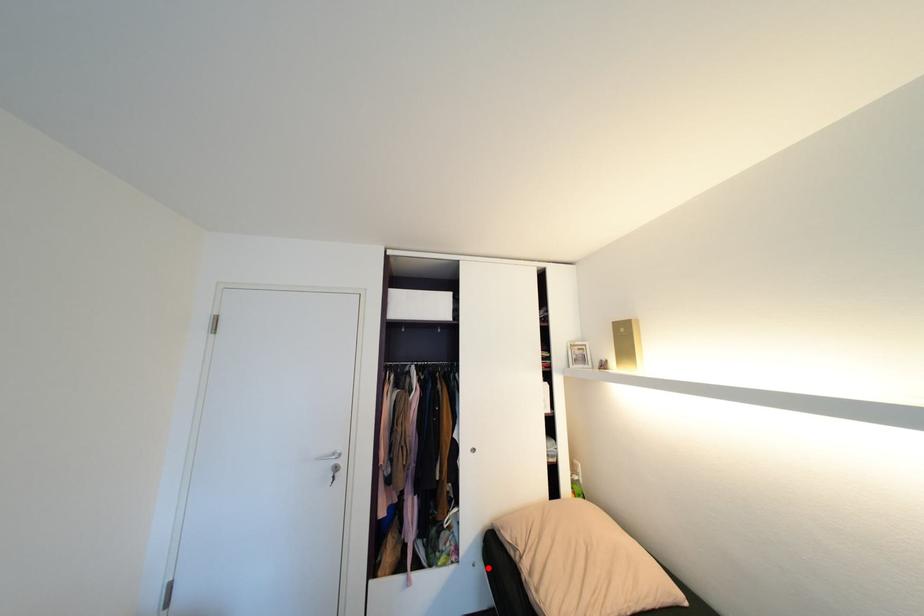
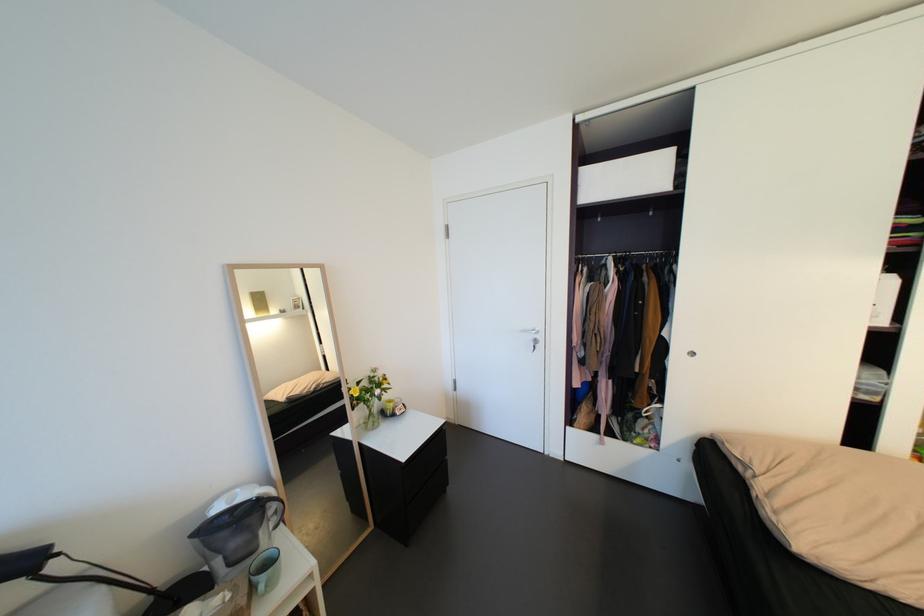
In the second image, find the point that corresponds to the highlighted location in the first image.

(697, 467)